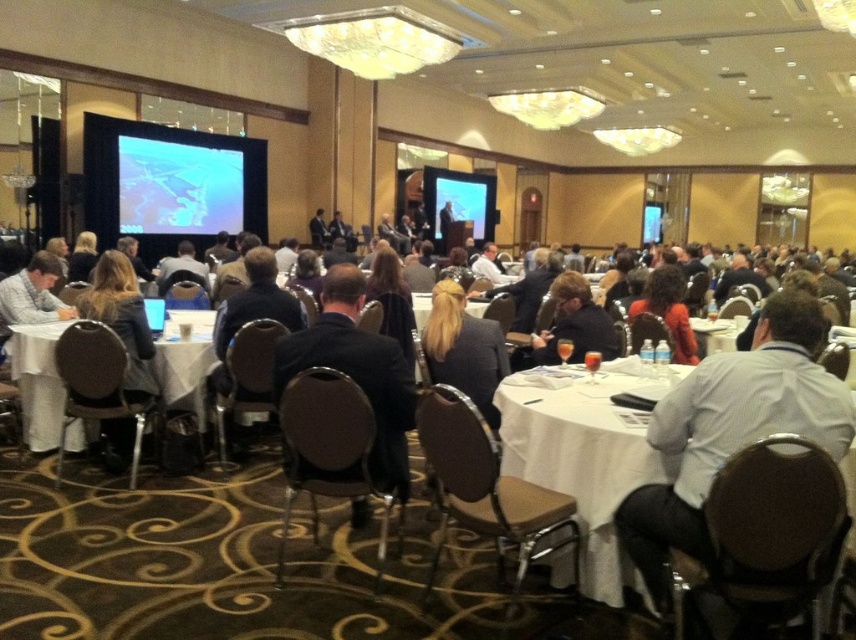
Does white shirt at right have a smaller size compared to white cloth-covered table at center?

Indeed, white shirt at right has a smaller size compared to white cloth-covered table at center.

Who is more forward, [771,340] or [593,484]?

Positioned in front is point [771,340].

I want to click on white shirt at right, so click(730, 429).

Between white cloth-covered table at center and dark suit at center, which one appears on the left side from the viewer's perspective?

From the viewer's perspective, dark suit at center appears more on the left side.

Is point (597, 429) in front of point (408, 428)?

Yes.

What do you see at coordinates (586, 454) in the screenshot? This screenshot has width=856, height=640. I see `white cloth-covered table at center` at bounding box center [586, 454].

This screenshot has height=640, width=856. What are the coordinates of `white cloth-covered table at center` in the screenshot? It's located at (586, 454).

Can you confirm if white shirt at right is positioned above dark suit at center?

No, white shirt at right is not above dark suit at center.

Image resolution: width=856 pixels, height=640 pixels. What are the coordinates of `white shirt at right` in the screenshot? It's located at click(730, 429).